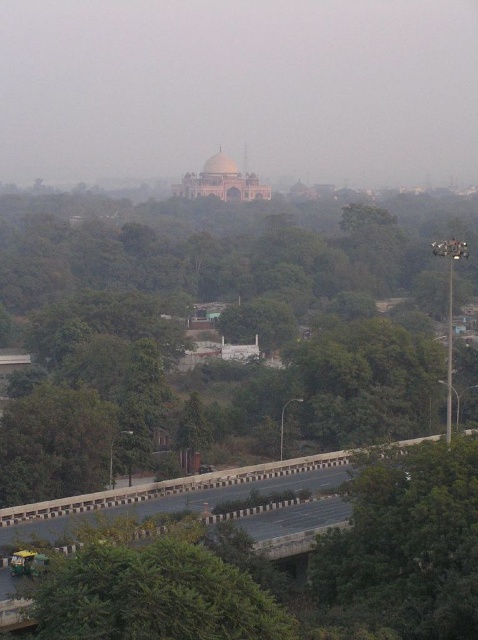
Question: Which point is farther from the camera taking this photo?

Choices:
 (A) pos(154,541)
 (B) pos(436,632)
 (C) pos(328,481)

Answer: (C)

Question: Is green leafy tree at lower right behind green leafy tree at lower center?

Choices:
 (A) yes
 (B) no

Answer: (A)

Question: Can you confirm if green leafy tree at lower right is positioned to the right of green leafy tree at lower center?

Choices:
 (A) yes
 (B) no

Answer: (A)

Question: Does green leafy tree at lower center come in front of asphalt road at lower center?

Choices:
 (A) yes
 (B) no

Answer: (A)

Question: Which is farther from the green leafy tree at lower center?

Choices:
 (A) asphalt road at lower center
 (B) green leafy tree at center
 (C) green leafy tree at lower right

Answer: (B)

Question: Which point is farther to the camera?

Choices:
 (A) (315, 582)
 (B) (52, 611)
 (C) (324, 522)

Answer: (C)